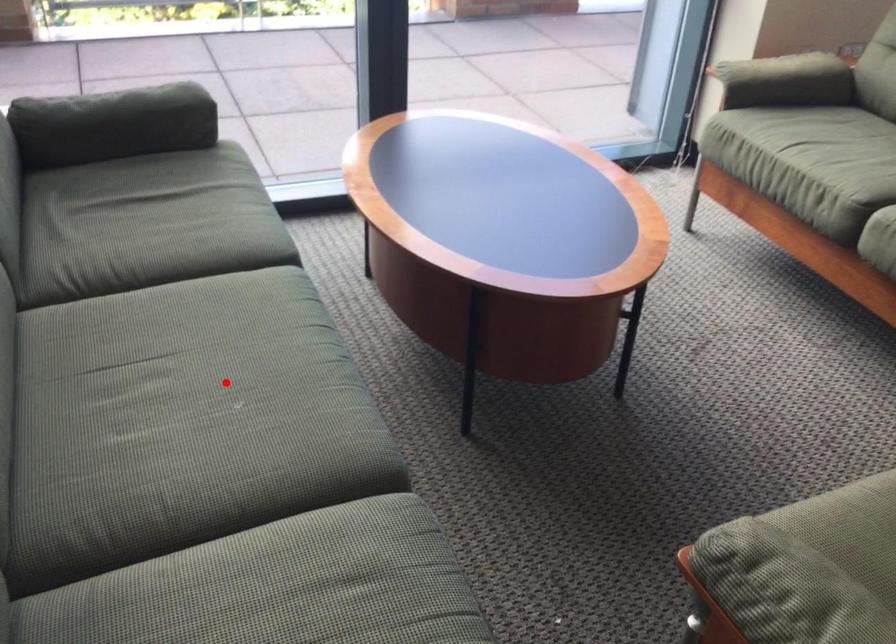
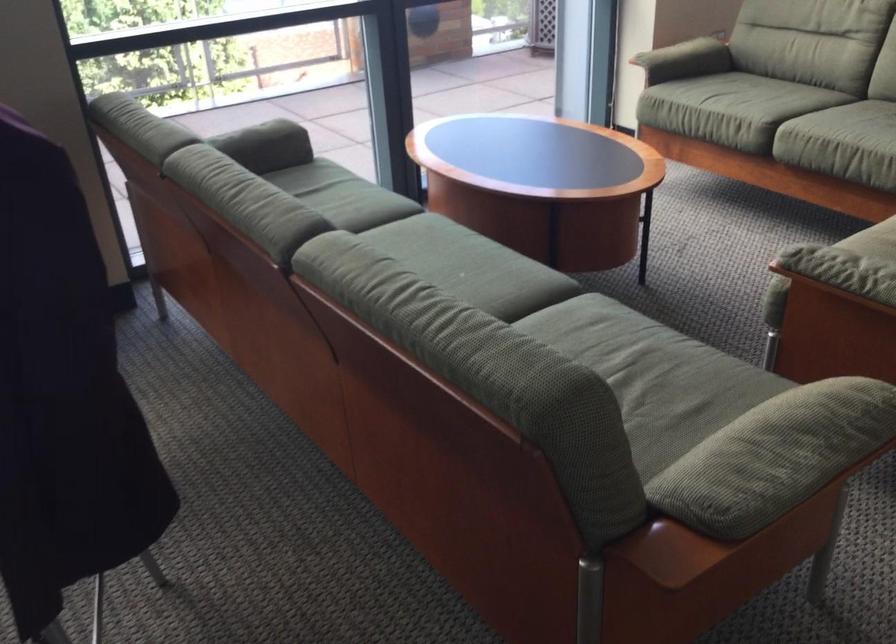
Locate, in the second image, the point that corresponds to the highlighted location in the first image.

(442, 267)